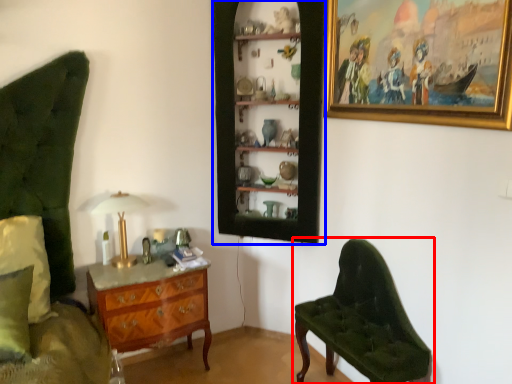
Question: Which object appears farthest to the camera in this image, chair (highlighted by a red box) or shelf (highlighted by a blue box)?

Choices:
 (A) chair
 (B) shelf

Answer: (B)